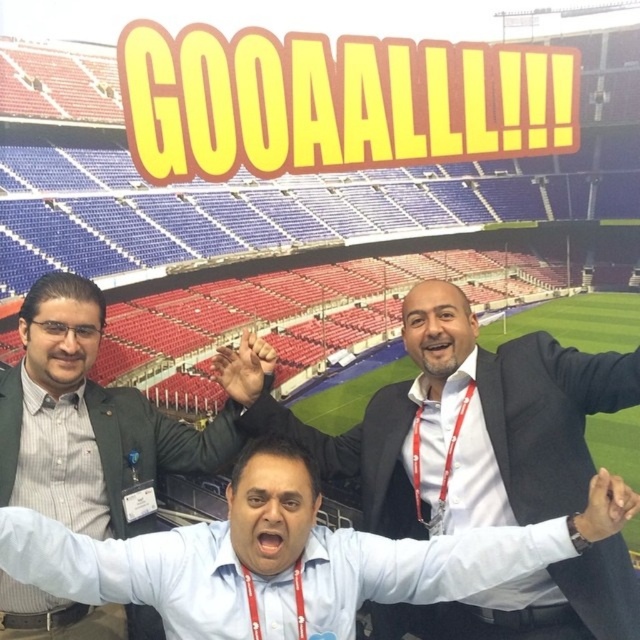
Question: Is white glossy shirt at center below blue shirt at center?

Choices:
 (A) no
 (B) yes

Answer: (A)

Question: Estimate the real-world distances between objects in this image. Which object is closer to the blue shirt at center?

Choices:
 (A) white glossy shirt at center
 (B) matte black jacket at upper left

Answer: (A)

Question: Where is blue shirt at center located in relation to matte black jacket at upper left in the image?

Choices:
 (A) left
 (B) right

Answer: (B)

Question: Which of the following is the closest to the observer?

Choices:
 (A) (378, 464)
 (B) (563, 545)
 (C) (83, 401)

Answer: (B)

Question: Estimate the real-world distances between objects in this image. Which object is farther from the matte black jacket at upper left?

Choices:
 (A) blue shirt at center
 (B) white glossy shirt at center

Answer: (B)

Question: Is white glossy shirt at center positioned in front of blue shirt at center?

Choices:
 (A) yes
 (B) no

Answer: (B)